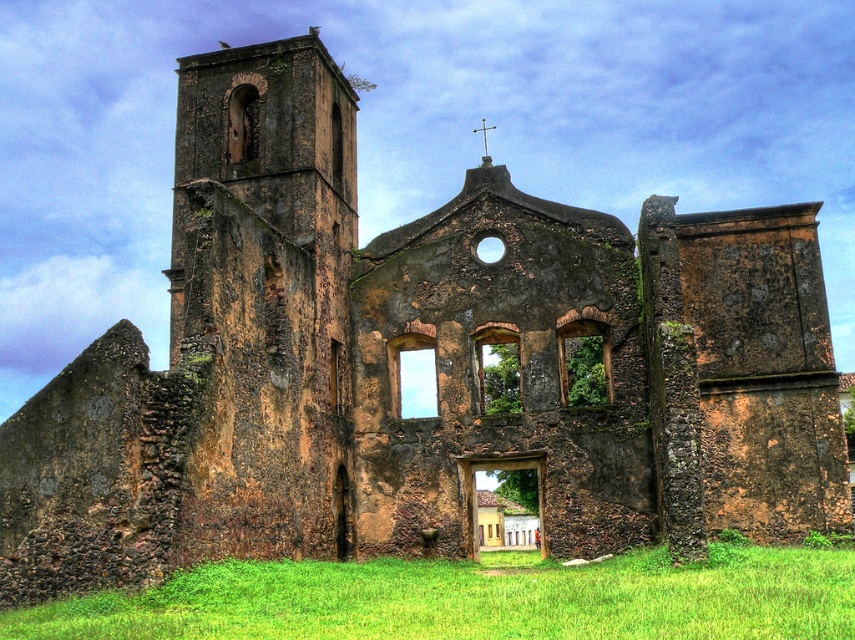
Question: Can you confirm if rusty stone tower at left is positioned to the left of green grass at lower center?

Choices:
 (A) no
 (B) yes

Answer: (B)

Question: Which object is closer to the camera taking this photo?

Choices:
 (A) green grass at lower center
 (B) rusty stone tower at left

Answer: (A)

Question: Which object is closer to the camera taking this photo?

Choices:
 (A) green grass at lower center
 (B) rusty stone tower at left

Answer: (A)

Question: Considering the relative positions of rusty stone tower at left and green grass at lower center in the image provided, where is rusty stone tower at left located with respect to green grass at lower center?

Choices:
 (A) right
 (B) left

Answer: (B)

Question: Does rusty stone tower at left have a larger size compared to green grass at lower center?

Choices:
 (A) no
 (B) yes

Answer: (B)

Question: Which of the following is the closest to the observer?

Choices:
 (A) rusty stone tower at left
 (B) green grass at lower center

Answer: (B)